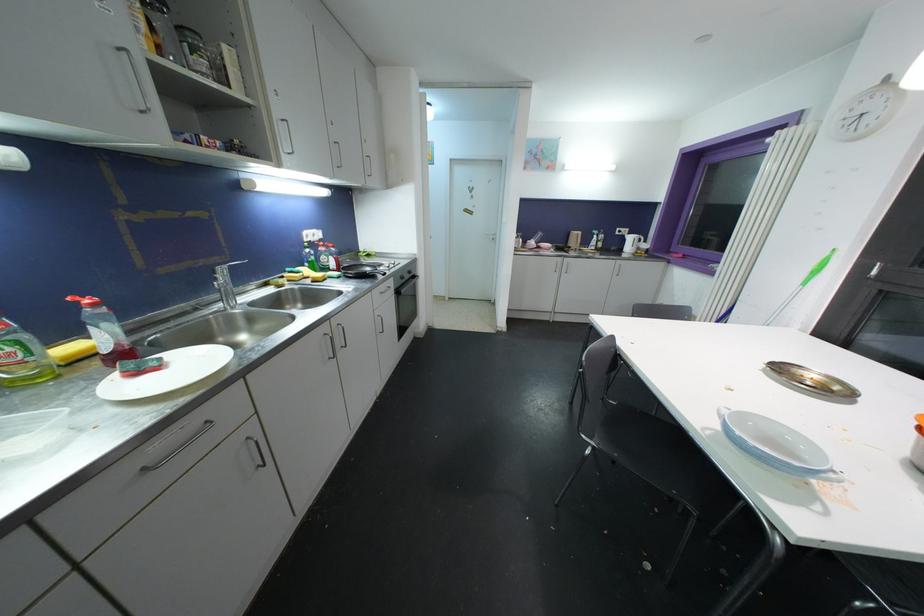
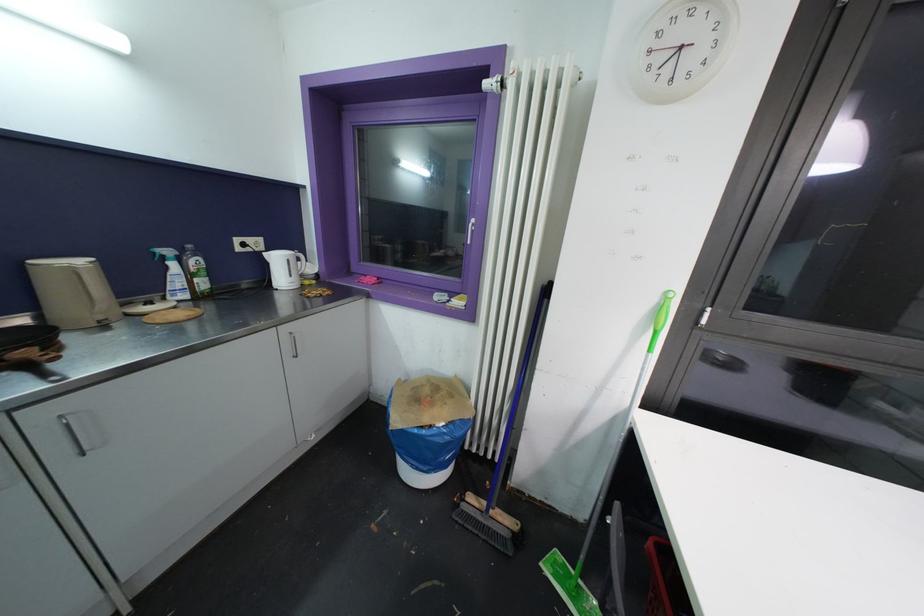
The point at (599, 238) is marked in the first image. Where is the corresponding point in the second image?

(176, 267)